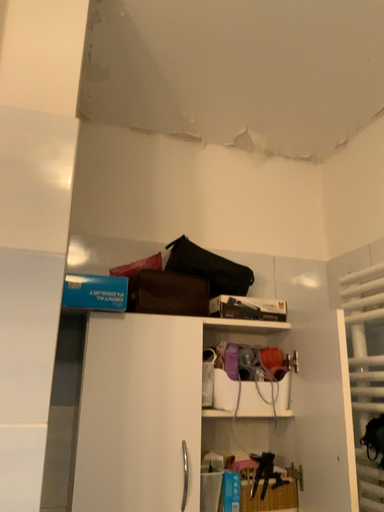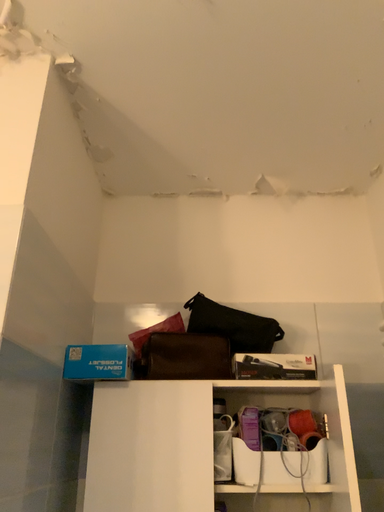
Question: How did the camera likely rotate when shooting the video?

Choices:
 (A) rotated left
 (B) rotated right

Answer: (A)